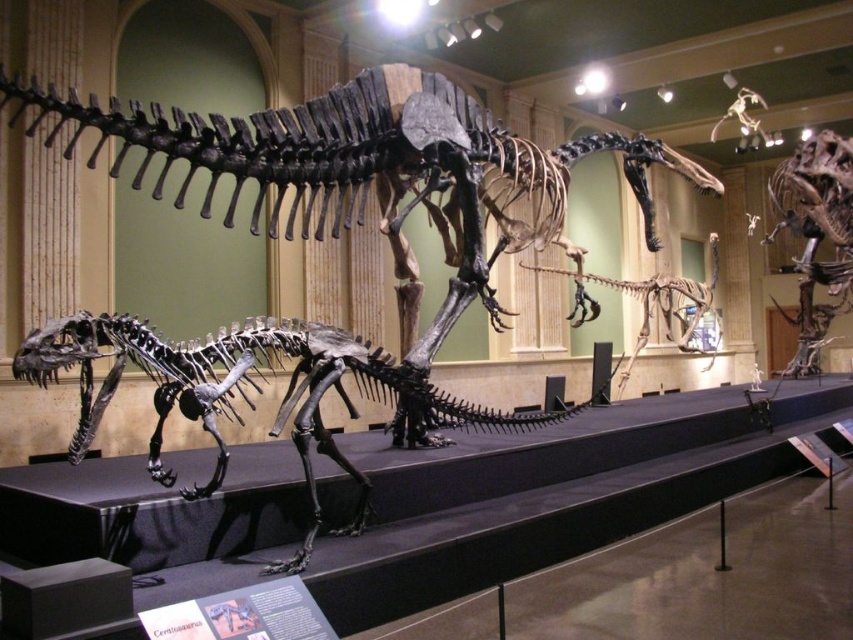
Who is more forward, (817, 337) or (703, 298)?

Point (703, 298) is in front.

Image resolution: width=853 pixels, height=640 pixels. What are the coordinates of `brown bone-like dinosaur at center` in the screenshot? It's located at (816, 236).

Consider the image. Which of these two, black metallic dinosaur at center or brown bone-like dinosaur at center, stands shorter?

brown bone-like dinosaur at center

Does black metallic dinosaur at center have a smaller size compared to brown bone-like dinosaur at center?

Actually, black metallic dinosaur at center might be larger than brown bone-like dinosaur at center.

From the picture: Who is more distant from viewer, (189,403) or (766,243)?

The point (766,243) is behind.

The width and height of the screenshot is (853, 640). Find the location of `black metallic dinosaur at center`. black metallic dinosaur at center is located at coordinates (245, 392).

Between black metallic dinosaur at center and bone-like skeleton at center, which one has more height?

With more height is bone-like skeleton at center.

Can you confirm if black metallic dinosaur at center is positioned below bone-like skeleton at center?

Indeed, black metallic dinosaur at center is positioned under bone-like skeleton at center.

Is point (140, 340) more distant than point (653, 291)?

No.

Locate an element on the screen. black metallic dinosaur at center is located at coordinates (245, 392).